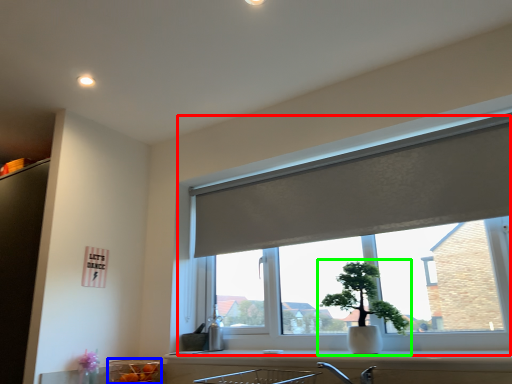
Question: Which object is positioned closest to window (highlighted by a red box)? Select from glass bowl (highlighted by a blue box) and houseplant (highlighted by a green box).

Choices:
 (A) glass bowl
 (B) houseplant

Answer: (B)